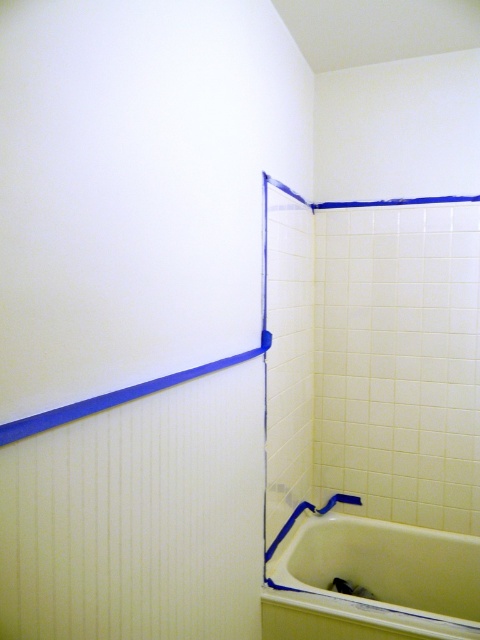
Between white glossy bathtub at lower right and blue tape at upper center, which one is positioned lower?

white glossy bathtub at lower right is below.

Is white glossy bathtub at lower right smaller than blue tape at upper center?

Actually, white glossy bathtub at lower right might be larger than blue tape at upper center.

Is point (315, 518) closer to camera compared to point (247, 355)?

No, it is behind (247, 355).

I want to click on white glossy bathtub at lower right, so click(372, 582).